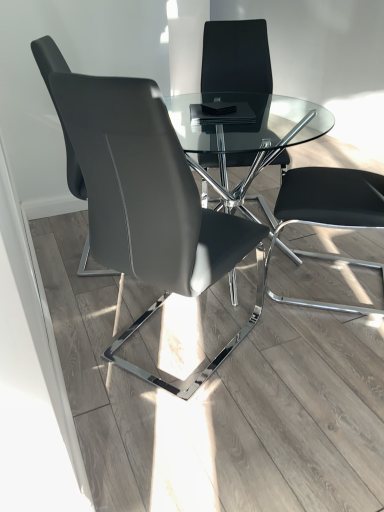
Locate an element on the screen. This screenshot has width=384, height=512. vacant position to the left of matte black chair at center, placed as the first chair when sorted from front to back is located at coordinates (90, 321).